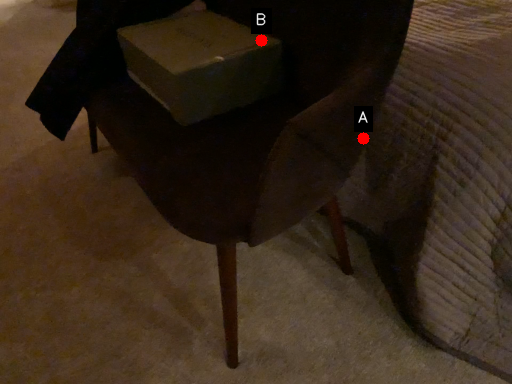
Question: Two points are circled on the image, labeled by A and B beside each circle. Which point is closer to the camera?

Choices:
 (A) A is closer
 (B) B is closer

Answer: (A)